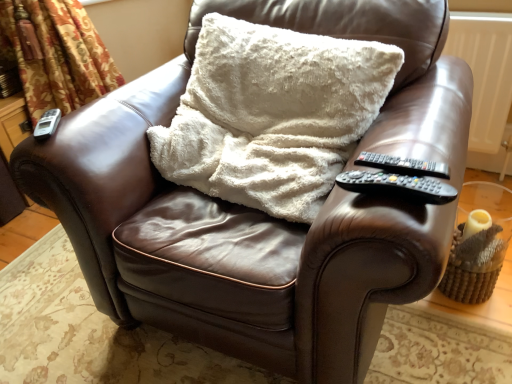
Question: Considering the positions of silver metallic remote at upper left, which is the 3th remote from bottom to top, and white fluffy pillow at center in the image, is silver metallic remote at upper left, which is the 3th remote from bottom to top, bigger or smaller than white fluffy pillow at center?

Choices:
 (A) small
 (B) big

Answer: (A)

Question: Considering their positions, is silver metallic remote at upper left, which is the 3th remote from bottom to top, located in front of or behind white fluffy pillow at center?

Choices:
 (A) behind
 (B) front

Answer: (A)

Question: Which object is positioned farthest from the black plastic remote at right, the second remote when ordered from top to bottom?

Choices:
 (A) silver metallic remote at upper left, acting as the first remote starting from the left
 (B) black plastic remote at right armrest, the 1th remote positioned from the front
 (C) floral fabric curtain at left
 (D) white fluffy pillow at center

Answer: (C)

Question: Estimate the real-world distances between objects in this image. Which object is closer to the floral fabric curtain at left?

Choices:
 (A) black plastic remote at right, the second remote when ordered from bottom to top
 (B) silver metallic remote at upper left, the 1th remote in the top-to-bottom sequence
 (C) black plastic remote at right armrest, the 1th remote positioned from the front
 (D) white fluffy pillow at center

Answer: (B)